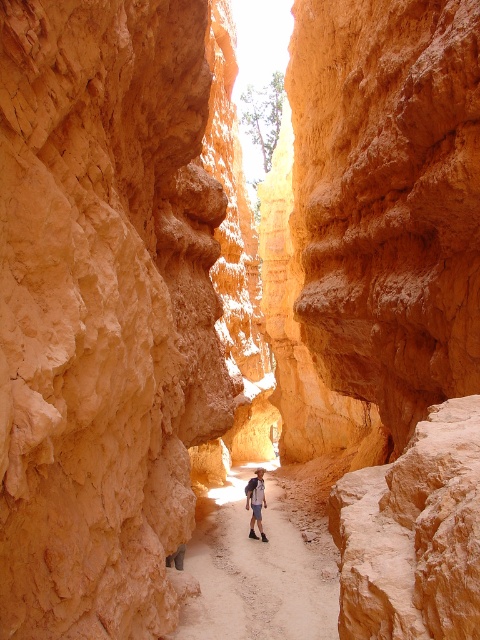
Can you confirm if sandy dirt path at center is smaller than denim shorts at center?

No, sandy dirt path at center is not smaller than denim shorts at center.

Is sandy dirt path at center bigger than denim shorts at center?

Yes, sandy dirt path at center is bigger than denim shorts at center.

The width and height of the screenshot is (480, 640). What do you see at coordinates (259, 568) in the screenshot?
I see `sandy dirt path at center` at bounding box center [259, 568].

This screenshot has height=640, width=480. What are the coordinates of `sandy dirt path at center` in the screenshot? It's located at (259, 568).